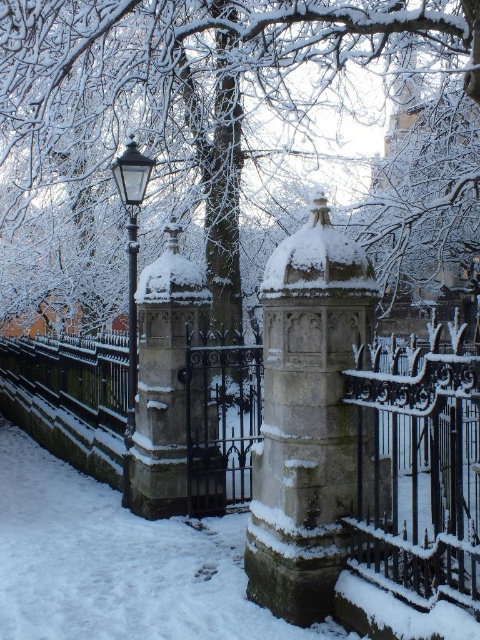
Based on the photo, does stone textured fence at center come behind black glass lamp post at left?

No, it is in front of black glass lamp post at left.

Does stone textured fence at center have a larger size compared to black glass lamp post at left?

Indeed, stone textured fence at center has a larger size compared to black glass lamp post at left.

Measure the distance between stone textured fence at center and camera.

stone textured fence at center and camera are 4.01 meters apart from each other.

The width and height of the screenshot is (480, 640). Find the location of `stone textured fence at center`. stone textured fence at center is located at coordinates (429, 500).

Who is more forward, [15,246] or [60,433]?

Point [60,433]

I want to click on snow-covered tree at center, so click(x=228, y=134).

Does point (375, 44) come closer to viewer compared to point (412, 470)?

No, it is behind (412, 470).

Find the location of a particular element. This screenshot has width=480, height=640. snow-covered tree at center is located at coordinates (228, 134).

Is snow-covered tree at center positioned at the back of black glass lamp post at left?

No, it is in front of black glass lamp post at left.

Is point (120, 289) in front of point (135, 333)?

That is False.

This screenshot has height=640, width=480. Identify the location of snow-covered tree at center. (228, 134).